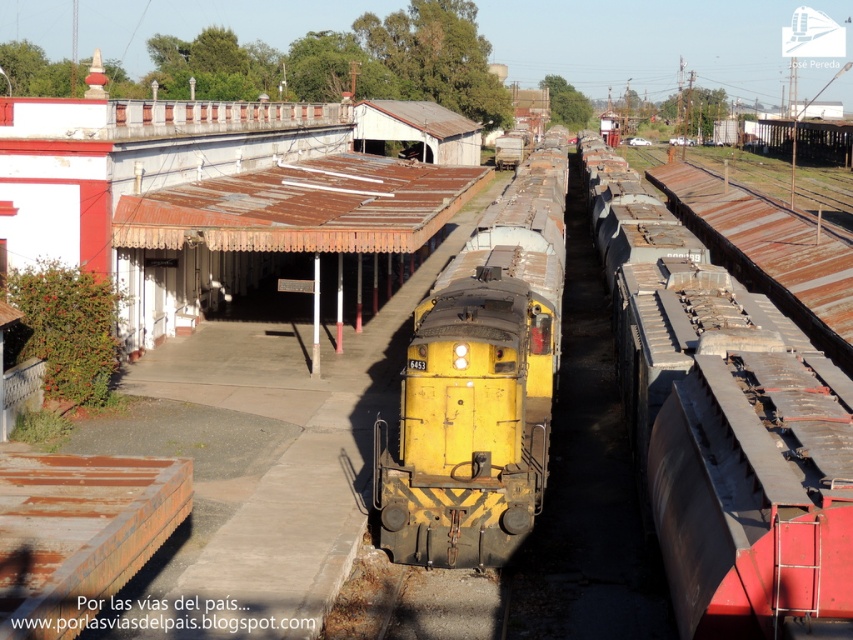
Is rusty metal train car at right shorter than yellow matte train at center?

Correct, rusty metal train car at right is not as tall as yellow matte train at center.

Which is behind, point (769, 301) or point (541, 164)?

Positioned behind is point (541, 164).

I want to click on rusty metal train car at right, so click(x=735, y=452).